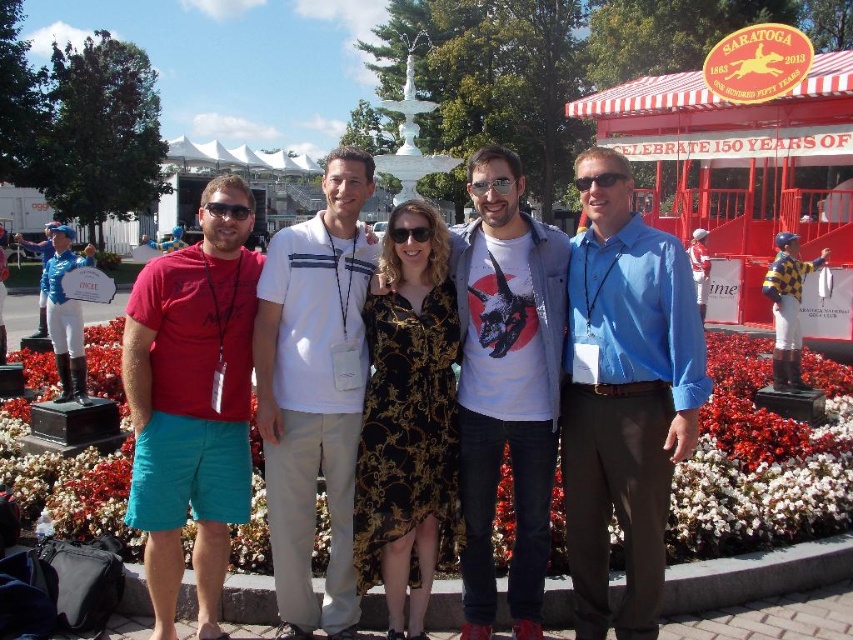
Question: Which is farther from the black plastic sunglasses at center?

Choices:
 (A) blue shirt at center
 (B) white cotton shirt at center

Answer: (A)

Question: Which point is closer to the camera taking this photo?

Choices:
 (A) (820, 252)
 (B) (496, 192)
 (C) (165, 620)

Answer: (C)

Question: Can you confirm if white matte t-shirt at center is thinner than matte black goggles at center?

Choices:
 (A) yes
 (B) no

Answer: (B)

Question: Does matte red t-shirt at left have a greater width compared to yellow checkered fabric jockey at center?

Choices:
 (A) no
 (B) yes

Answer: (B)

Question: Which object is the closest to the black plastic sunglasses at center?

Choices:
 (A) white cotton shirt at center
 (B) white matte t-shirt at center
 (C) blue shirt at center
 (D) matte red t-shirt at left

Answer: (B)

Question: Does white matte t-shirt at center come behind black plastic sunglasses at center?

Choices:
 (A) no
 (B) yes

Answer: (A)